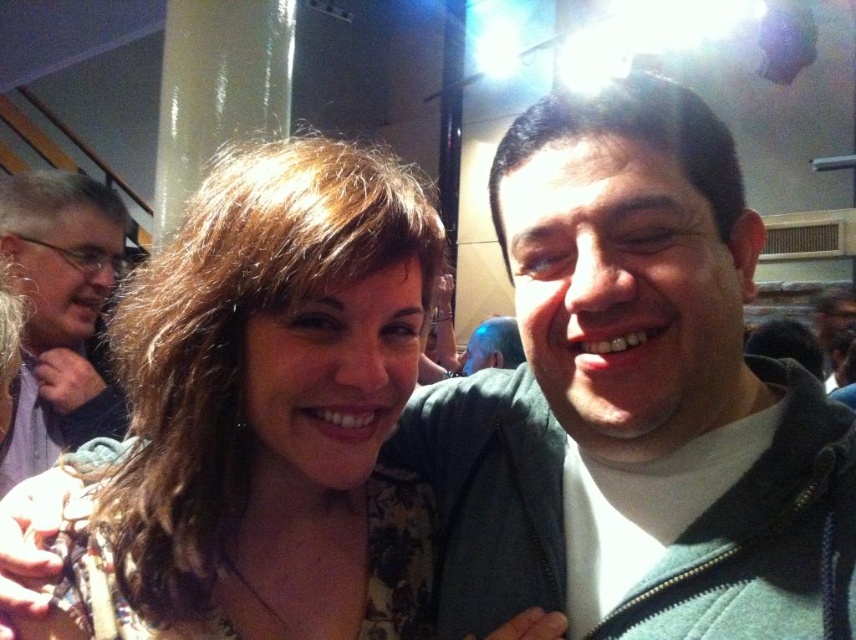
Is matte floral dress at center smaller than gray fabric shirt at left?

Correct, matte floral dress at center occupies less space than gray fabric shirt at left.

Who is more distant from viewer, (x=281, y=541) or (x=85, y=403)?

The point (x=85, y=403) is more distant.

Which is in front, point (316, 285) or point (27, 262)?

Positioned in front is point (316, 285).

Locate an element on the screen. This screenshot has height=640, width=856. matte floral dress at center is located at coordinates (269, 381).

Does gray fabric shirt at left have a lesser height compared to blue metallic head at center?

No, gray fabric shirt at left is not shorter than blue metallic head at center.

Can you confirm if gray fabric shirt at left is positioned to the left of blue metallic head at center?

Yes, gray fabric shirt at left is to the left of blue metallic head at center.

Between point (54, 204) and point (503, 349), which one is positioned in front?

Point (54, 204) is more forward.

You are a GUI agent. You are given a task and a screenshot of the screen. Output one action in this format:
    pyautogui.click(x=<x>, y=<y>)
    Task: Click on the gray fabric shirt at left
    The height and width of the screenshot is (640, 856).
    Given the screenshot: What is the action you would take?
    pyautogui.click(x=58, y=314)

Is matte floral dress at center further to the viewer compared to blue metallic head at center?

No, matte floral dress at center is in front of blue metallic head at center.

Is matte floral dress at center bigger than blue metallic head at center?

Correct, matte floral dress at center is larger in size than blue metallic head at center.

In order to click on matte floral dress at center in this screenshot , I will do `click(269, 381)`.

Locate an element on the screen. Image resolution: width=856 pixels, height=640 pixels. matte floral dress at center is located at coordinates tap(269, 381).